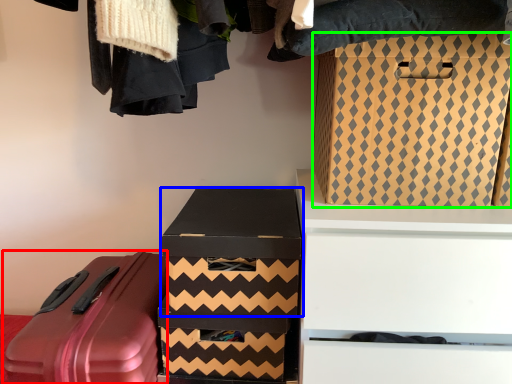
Question: Based on their relative distances, which object is farther from suitcase (highlighted by a red box)? Choose from box (highlighted by a blue box) and box (highlighted by a green box).

Choices:
 (A) box
 (B) box

Answer: (B)